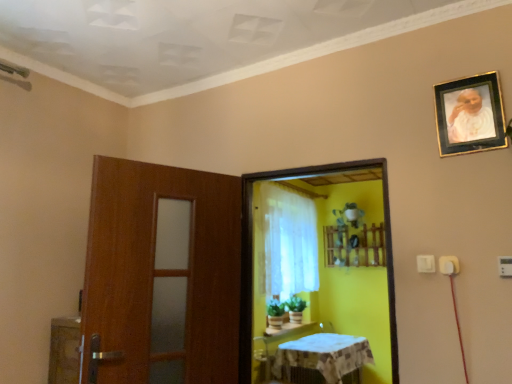
Question: From the image's perspective, is white sheer curtain at center located beneath white glossy table at lower center?

Choices:
 (A) yes
 (B) no

Answer: (B)

Question: Is white sheer curtain at center positioned before white glossy table at lower center?

Choices:
 (A) yes
 (B) no

Answer: (B)

Question: Does white sheer curtain at center appear on the right side of white glossy table at lower center?

Choices:
 (A) no
 (B) yes

Answer: (B)

Question: Does white sheer curtain at center have a greater width compared to white glossy table at lower center?

Choices:
 (A) no
 (B) yes

Answer: (A)

Question: Is white sheer curtain at center bigger than white glossy table at lower center?

Choices:
 (A) yes
 (B) no

Answer: (A)

Question: In terms of size, does white sheer curtain at center appear bigger or smaller than yellow matte screen door at center?

Choices:
 (A) big
 (B) small

Answer: (A)

Question: Would you say white sheer curtain at center is inside or outside yellow matte screen door at center?

Choices:
 (A) inside
 (B) outside

Answer: (B)

Question: Considering the positions of point (303, 269) and point (379, 160), is point (303, 269) closer or farther from the camera than point (379, 160)?

Choices:
 (A) farther
 (B) closer

Answer: (A)

Question: From a real-world perspective, is white sheer curtain at center physically located above or below yellow matte screen door at center?

Choices:
 (A) below
 (B) above

Answer: (B)

Question: Is gold-framed photo at upper right taller or shorter than white textured tablecloth at lower center?

Choices:
 (A) tall
 (B) short

Answer: (B)

Question: Is gold-framed photo at upper right to the left or to the right of white textured tablecloth at lower center in the image?

Choices:
 (A) left
 (B) right

Answer: (B)

Question: Is point (495, 119) positioned closer to the camera than point (286, 350)?

Choices:
 (A) closer
 (B) farther

Answer: (A)

Question: From a real-world perspective, is gold-framed photo at upper right physically located above or below white textured tablecloth at lower center?

Choices:
 (A) above
 (B) below

Answer: (A)

Question: Is wooden shelf at center bigger or smaller than gold-framed photo at upper right?

Choices:
 (A) big
 (B) small

Answer: (A)

Question: In terms of height, does wooden shelf at center look taller or shorter compared to gold-framed photo at upper right?

Choices:
 (A) tall
 (B) short

Answer: (A)